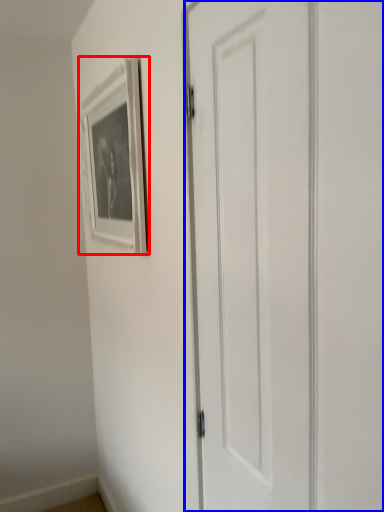
Question: Which object is further to the camera taking this photo, picture frame (highlighted by a red box) or door (highlighted by a blue box)?

Choices:
 (A) picture frame
 (B) door

Answer: (A)